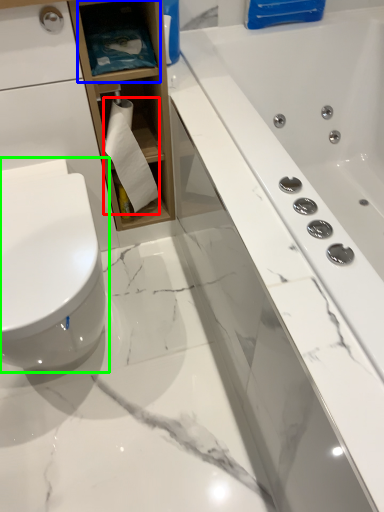
Question: Which object is positioned farthest from toilet paper (highlighted by a red box)? Select from shelf (highlighted by a blue box) and toilet (highlighted by a green box).

Choices:
 (A) shelf
 (B) toilet

Answer: (B)